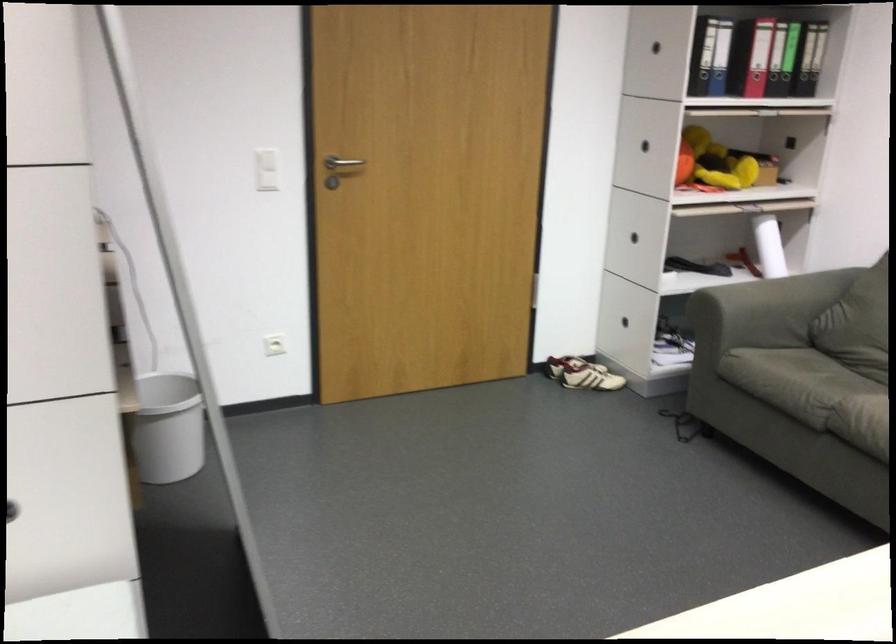
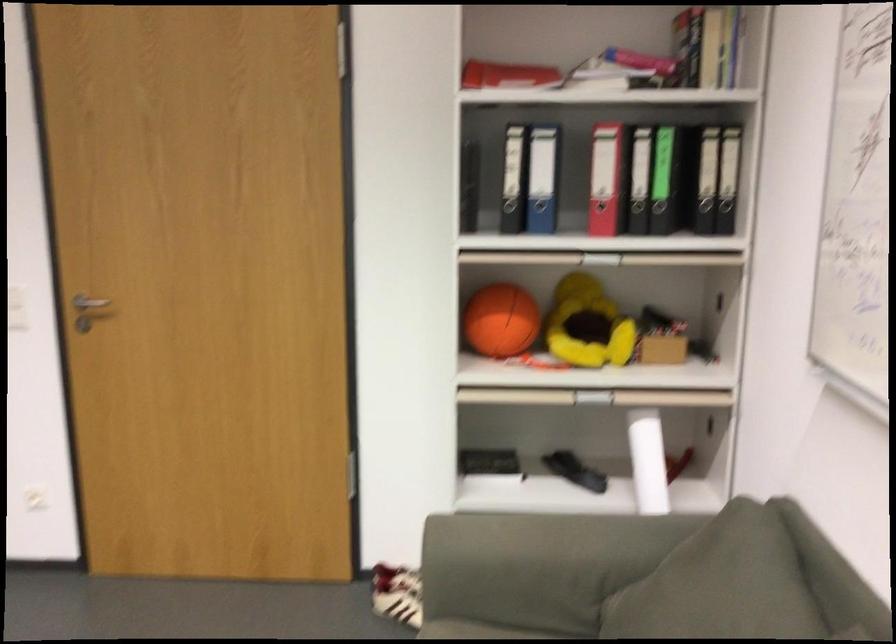
In the second image, find the point that corresponds to pixel 675 149 in the first image.

(501, 321)